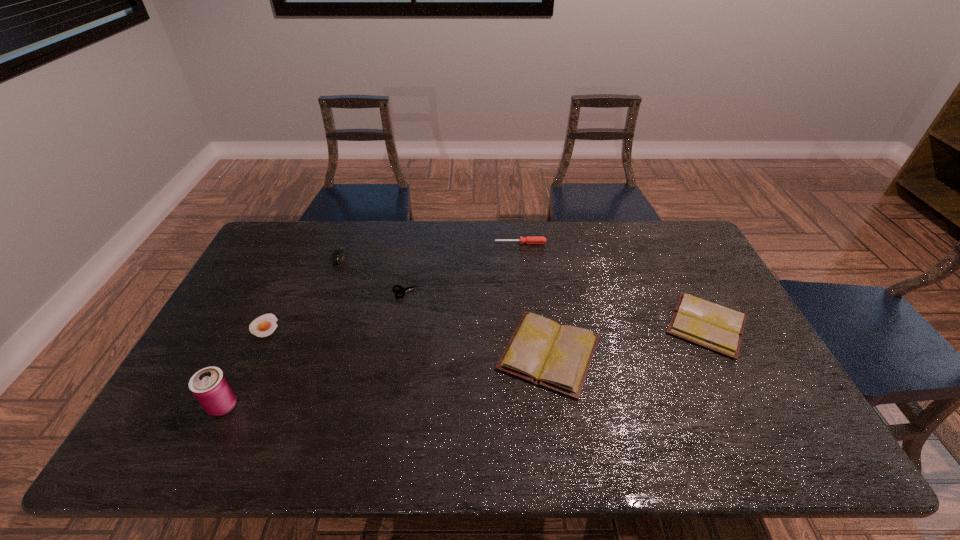
Find the location of `blank space located 0.250m on the left of the left diary`. blank space located 0.250m on the left of the left diary is located at coordinates pyautogui.click(x=403, y=353).

Where is `vacant space located on the left of the shorter diary`? vacant space located on the left of the shorter diary is located at coordinates (587, 325).

You are a GUI agent. You are given a task and a screenshot of the screen. Output one action in this format:
    pyautogui.click(x=<x>, y=<y>)
    Task: Click on the vacant space located on the front of the farthest object
    This screenshot has width=960, height=540.
    Given the screenshot: What is the action you would take?
    pyautogui.click(x=527, y=306)

The height and width of the screenshot is (540, 960). Find the location of `vacant area located 0.250m on the wheel side of the computer mouse`. vacant area located 0.250m on the wheel side of the computer mouse is located at coordinates (317, 321).

At what (x,y) coordinates should I click in order to perform the action: click on vacant space located on the back of the shortest object. Please return your answer as a coordinate pair (x, y). This screenshot has width=960, height=540. Looking at the image, I should click on (298, 256).

Where is `vacant space located 0.240m on the left of the second shortest object`? This screenshot has width=960, height=540. vacant space located 0.240m on the left of the second shortest object is located at coordinates (316, 293).

This screenshot has height=540, width=960. I want to click on free location located 0.180m on the right of the can, so click(x=311, y=405).

You are a GUI agent. You are given a task and a screenshot of the screen. Output one action in this format:
    pyautogui.click(x=<x>, y=<y>)
    Task: Click on the screwdriver at the far edge
    The width and height of the screenshot is (960, 540).
    Given the screenshot: What is the action you would take?
    pyautogui.click(x=529, y=239)

Locate an element on the screen. computer mouse at the far edge is located at coordinates (340, 254).

Identify the location of diary situated at the near edge. (557, 356).